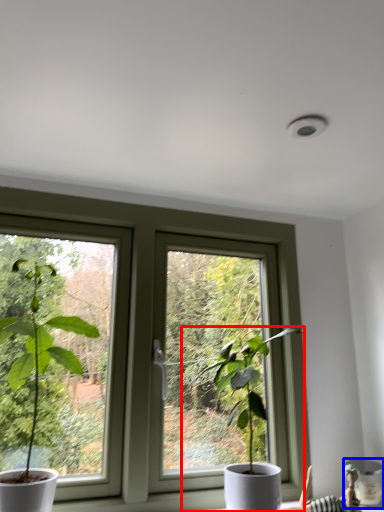
Question: Among these objects, which one is nearest to the camera, houseplant (highlighted by a red box) or vase (highlighted by a blue box)?

Choices:
 (A) houseplant
 (B) vase

Answer: (A)